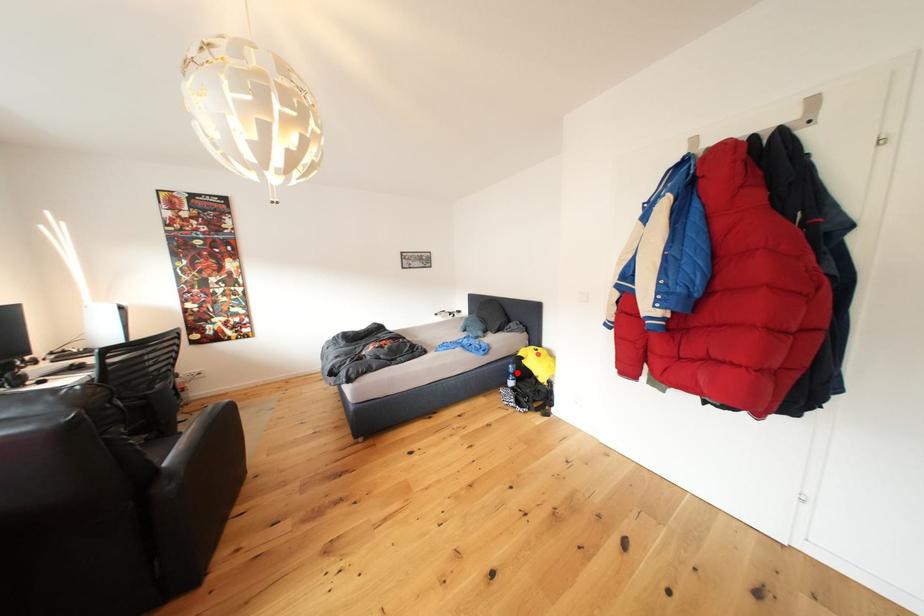
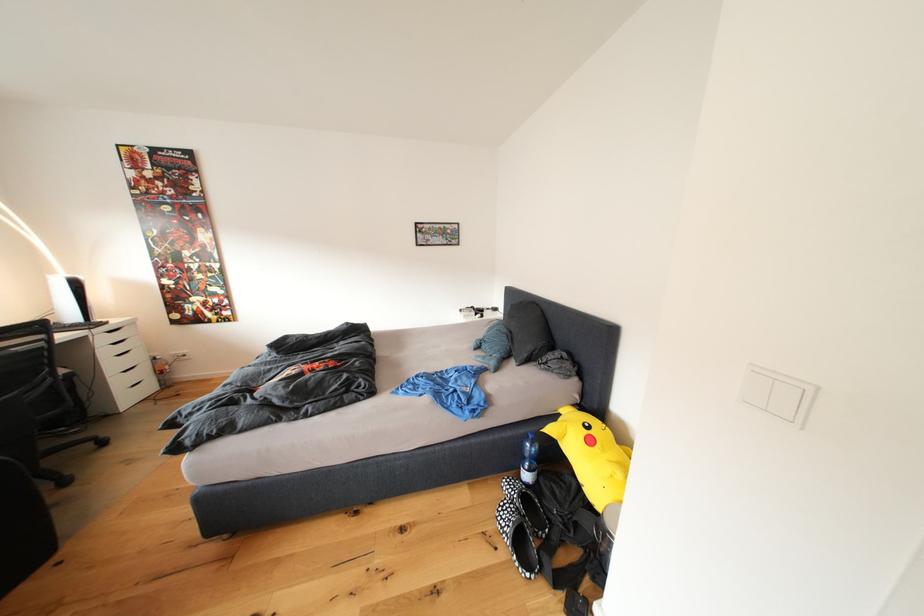
Where in the second image is the point corresponding to the highlighted location from the first image?

(531, 451)